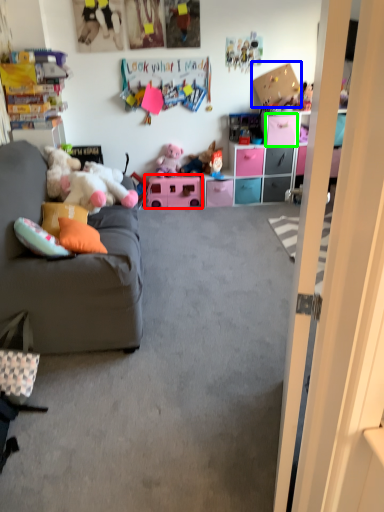
Question: Estimate the real-world distances between objects in this image. Which object is closer to toy (highlighted by a red box), cardboard box (highlighted by a blue box) or drawer (highlighted by a green box)?

Choices:
 (A) cardboard box
 (B) drawer

Answer: (B)